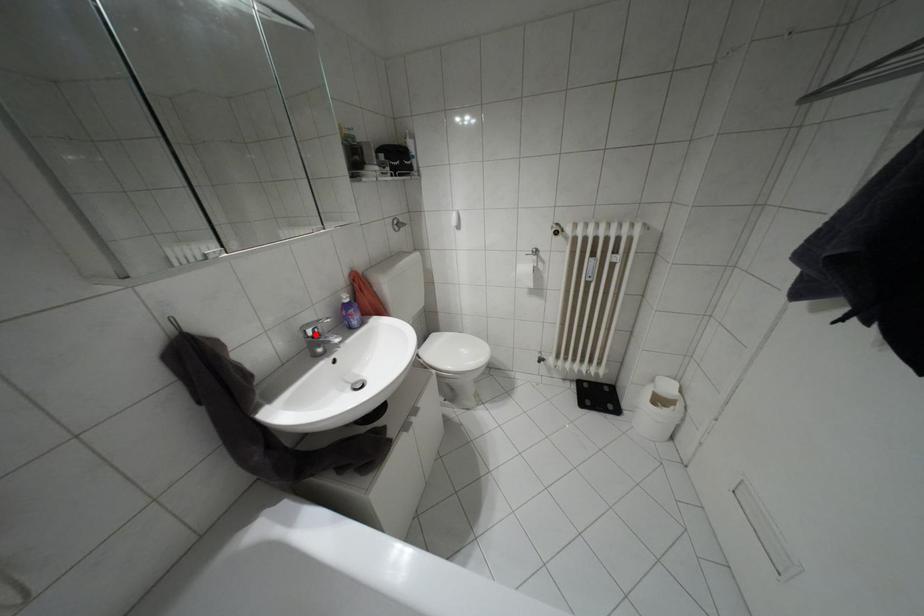
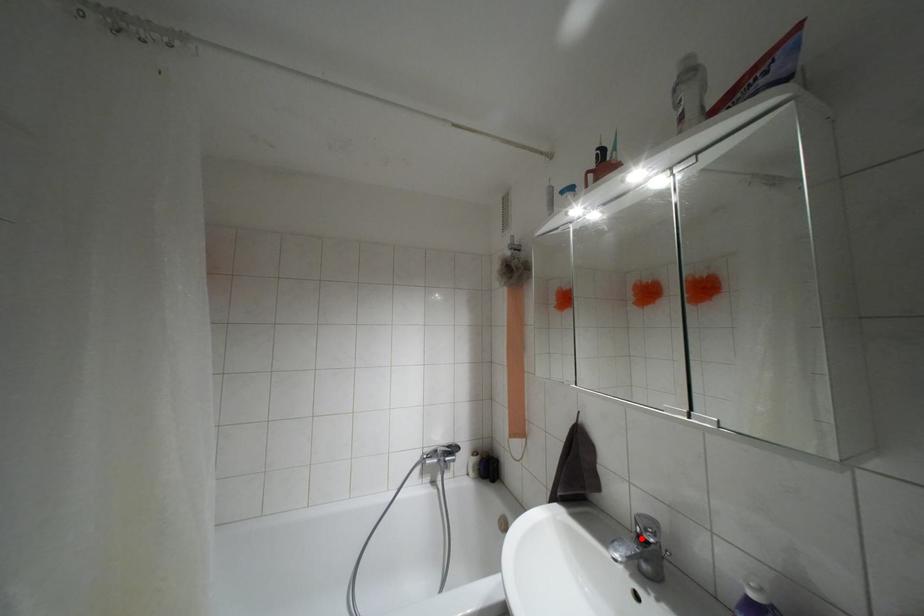
I am providing you with two images of the same scene from different viewpoints. A red point is marked on the first image and another point is marked on the second image. Do the highlighted points in image1 and image2 indicate the same real-world spot?

Yes